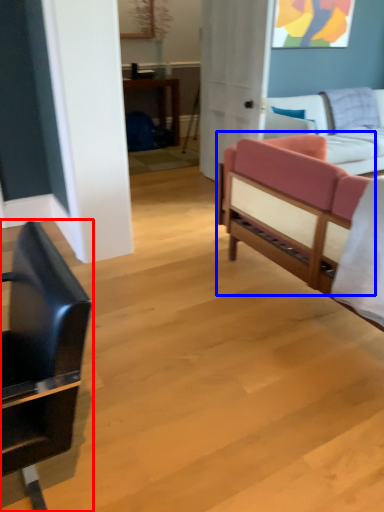
Question: Which point is further to the camera, chair (highlighted by a red box) or studio couch (highlighted by a blue box)?

Choices:
 (A) chair
 (B) studio couch

Answer: (B)